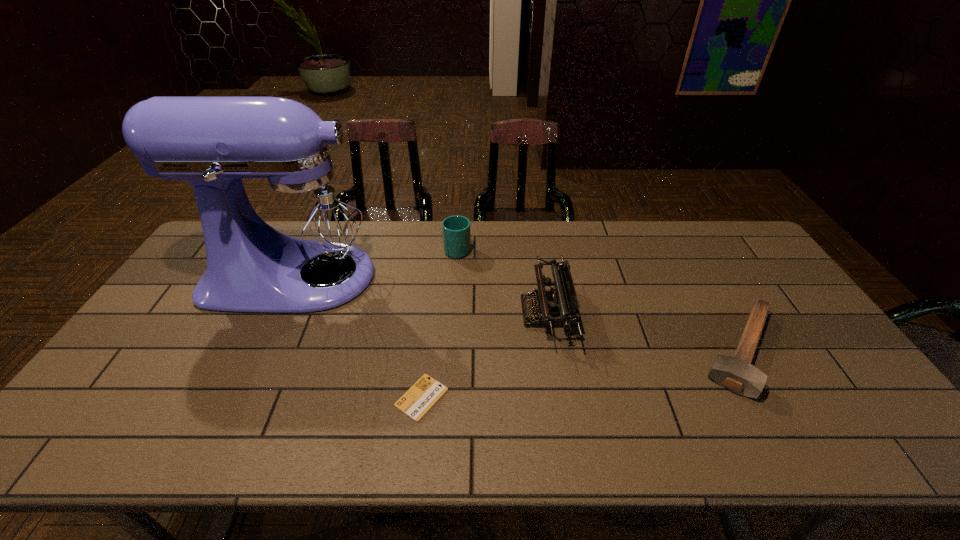
This screenshot has height=540, width=960. What are the coordinates of `the tallest object` in the screenshot? It's located at (296, 239).

You are a GUI agent. You are given a task and a screenshot of the screen. Output one action in this format:
    pyautogui.click(x=<x>, y=<y>)
    Task: Click on the leftmost object
    Image resolution: width=960 pixels, height=540 pixels.
    Given the screenshot: What is the action you would take?
    pyautogui.click(x=296, y=239)

Where is `cup`? The width and height of the screenshot is (960, 540). cup is located at coordinates (456, 231).

Where is `typewriter`? typewriter is located at coordinates (558, 307).

Where is `the fourth tallest object`? This screenshot has width=960, height=540. the fourth tallest object is located at coordinates (737, 374).

Find the location of a particular element. This screenshot has width=960, height=540. the rightmost object is located at coordinates click(737, 374).

Image resolution: width=960 pixels, height=540 pixels. In order to click on the shortest object in this screenshot , I will do `click(418, 400)`.

I want to click on vacant space located at the mixing area of the leftmost object, so click(x=488, y=277).

At what (x,y) coordinates should I click in order to perform the action: click on vacant space situated 0.060m on the handle side of the cup. Please return your answer as a coordinate pair (x, y). This screenshot has width=960, height=540. Looking at the image, I should click on (459, 228).

Where is `vacant area situated 0.080m on the handle side of the cup`? vacant area situated 0.080m on the handle side of the cup is located at coordinates (459, 225).